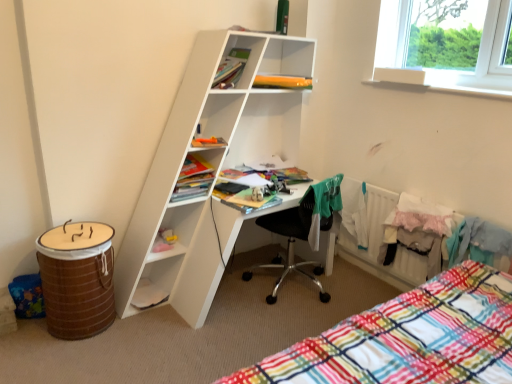
Where is `vacant space positioned to the left of black mesh chair at center`? This screenshot has width=512, height=384. vacant space positioned to the left of black mesh chair at center is located at coordinates (232, 291).